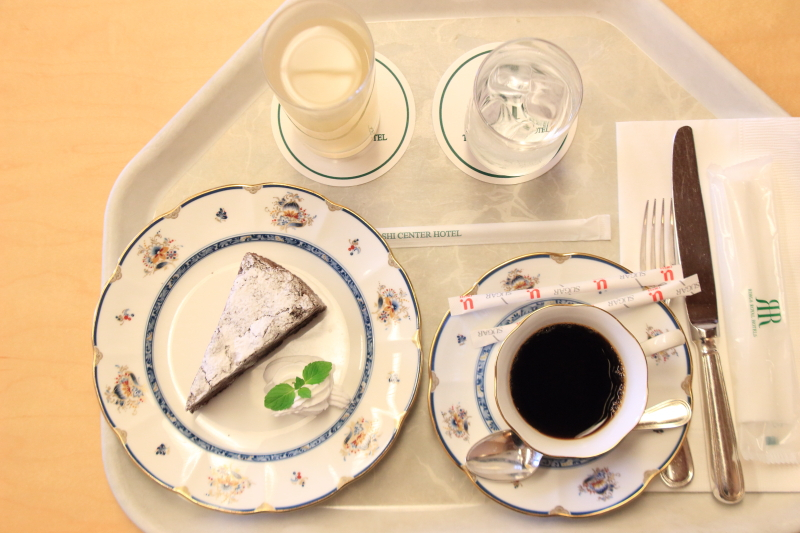
Locate an element on the screen. The height and width of the screenshot is (533, 800). saucer is located at coordinates (460, 371).